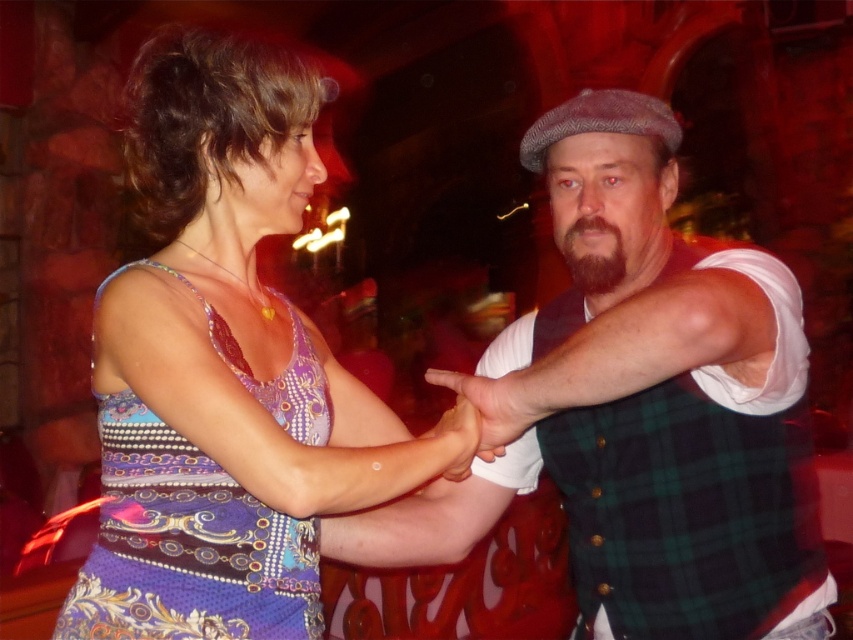
Question: Which of the following is the closest to the observer?

Choices:
 (A) green plaid vest at center
 (B) multicolored fabric dress at center

Answer: (A)

Question: Which is farther from the patterned silk dress at center?

Choices:
 (A) dark brown fuzzy beard at center
 (B) green plaid vest at center
 (C) matte black hand at center
 (D) multicolored fabric dress at center

Answer: (A)

Question: Which object appears closest to the camera in this image?

Choices:
 (A) green plaid vest at center
 (B) dark brown fuzzy beard at center
 (C) matte black hand at center
 (D) patterned silk dress at center

Answer: (A)

Question: Is multicolored fabric dress at center above matte black hand at center?

Choices:
 (A) yes
 (B) no

Answer: (A)

Question: Is patterned silk dress at center positioned in front of dark brown fuzzy beard at center?

Choices:
 (A) yes
 (B) no

Answer: (A)

Question: Observing the image, what is the correct spatial positioning of multicolored fabric dress at center in reference to patterned silk dress at center?

Choices:
 (A) below
 (B) above

Answer: (B)